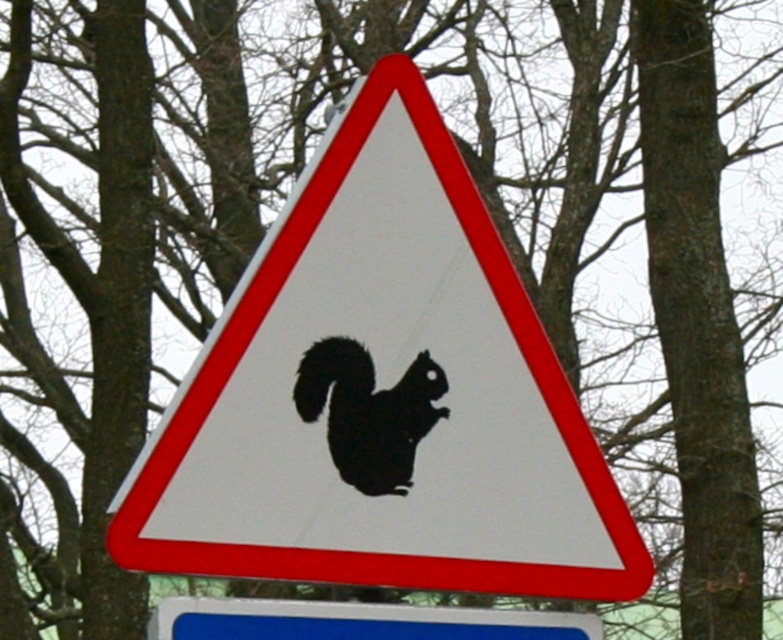
Question: Can you confirm if white plastic sign at center is positioned below black matte/silhouette squirrel at center?

Choices:
 (A) no
 (B) yes

Answer: (B)

Question: Which object is farther from the camera taking this photo?

Choices:
 (A) black matte/silhouette squirrel at center
 (B) white plastic sign at center

Answer: (A)

Question: Does white plastic sign at center have a lesser width compared to black matte/silhouette squirrel at center?

Choices:
 (A) yes
 (B) no

Answer: (B)

Question: Which of the following is the farthest from the observer?

Choices:
 (A) (341, 628)
 (B) (417, 365)

Answer: (B)

Question: Is white plastic sign at center smaller than black matte/silhouette squirrel at center?

Choices:
 (A) no
 (B) yes

Answer: (A)

Question: Which object appears closest to the camera in this image?

Choices:
 (A) white plastic sign at center
 (B) black matte/silhouette squirrel at center

Answer: (A)